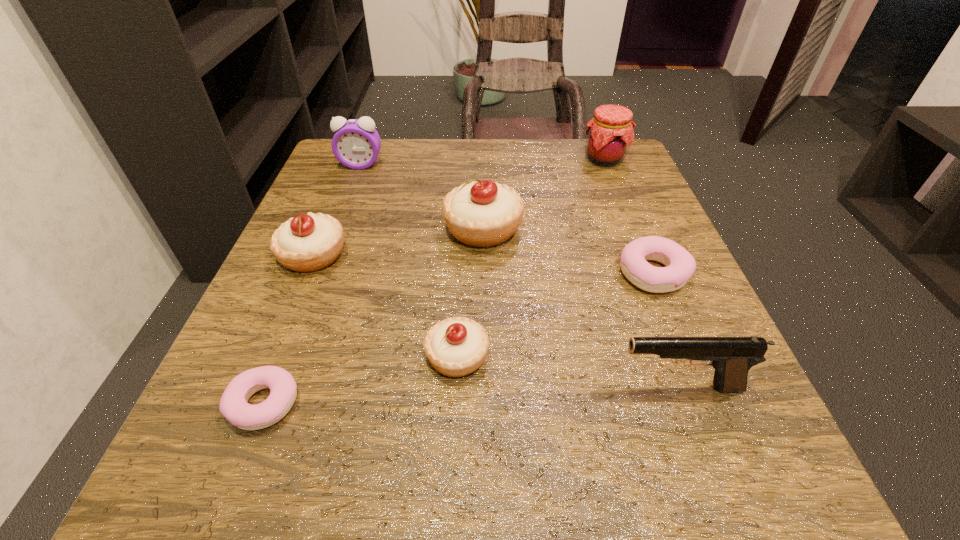
The width and height of the screenshot is (960, 540). Find the location of `pastry that can be found as the closest to the right pink pastry`. pastry that can be found as the closest to the right pink pastry is located at coordinates (481, 214).

Locate which pastry is the fifth closest to the jam. Please provide its 2D coordinates. Your answer should be formatted as a tuple, i.e. [(x, y)], where the tuple contains the x and y coordinates of a point satisfying the conditions above.

[(233, 406)]

Where is `beige pastry that is the closest to the fourth shortest pastry`? Image resolution: width=960 pixels, height=540 pixels. beige pastry that is the closest to the fourth shortest pastry is located at coordinates (481, 214).

At what (x,y) coordinates should I click in order to perform the action: click on beige pastry that is the second closest to the left pink pastry. Please return your answer as a coordinate pair (x, y). Looking at the image, I should click on (309, 242).

You are a GUI agent. You are given a task and a screenshot of the screen. Output one action in this format:
    pyautogui.click(x=<x>, y=<y>)
    Task: Click on the vacant space that satisfies the following two spatial constraints: 1. on the back side of the jam; 2. on the right side of the tallest pastry
    
    Given the screenshot: What is the action you would take?
    pyautogui.click(x=482, y=159)